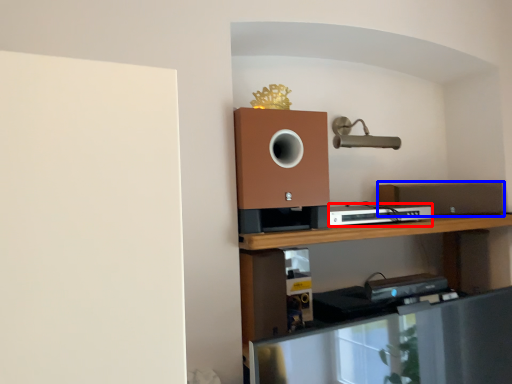
Question: Which object is further to the camera taking this photo, appliance (highlighted by a red box) or speaker (highlighted by a blue box)?

Choices:
 (A) appliance
 (B) speaker

Answer: (B)